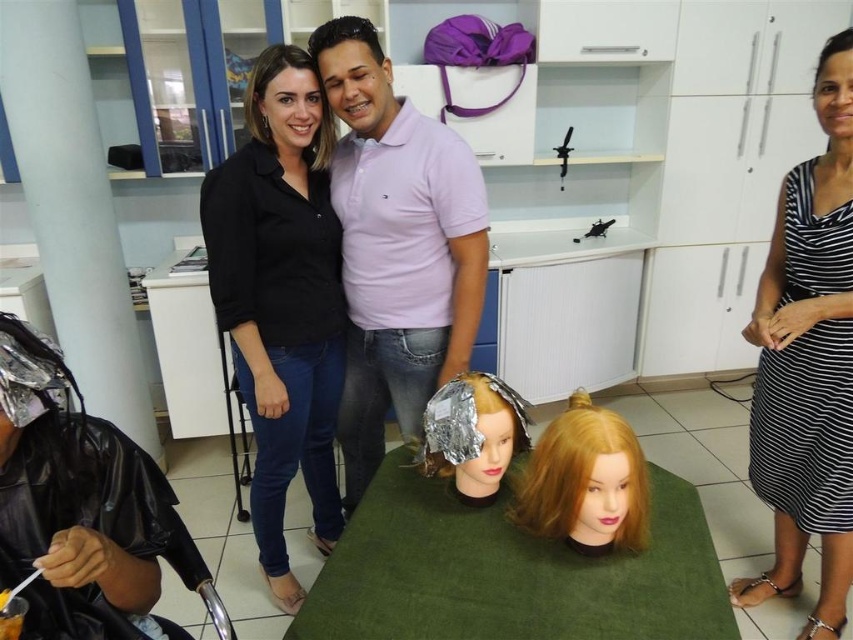
Question: Which is farther from the smooth white pillar at left?

Choices:
 (A) purple cotton polo shirt at center
 (B) matte black hair at upper center
 (C) black matte shirt at center

Answer: (A)

Question: Which is farther from the smooth white pillar at left?

Choices:
 (A) matte black hair at upper center
 (B) shiny gold foil at center

Answer: (B)

Question: Which object appears farthest from the camera in this image?

Choices:
 (A) matte black hair at upper center
 (B) dark brown hair at center
 (C) shiny gold foil at center
 (D) blonde synthetic hair at center

Answer: (A)

Question: Is the position of shiny gold foil at center less distant than that of matte black hair at upper center?

Choices:
 (A) no
 (B) yes

Answer: (B)

Question: Is black matte shirt at center in front of purple cotton polo shirt at center?

Choices:
 (A) no
 (B) yes

Answer: (A)

Question: Does black matte shirt at center appear under dark brown hair at center?

Choices:
 (A) yes
 (B) no

Answer: (A)